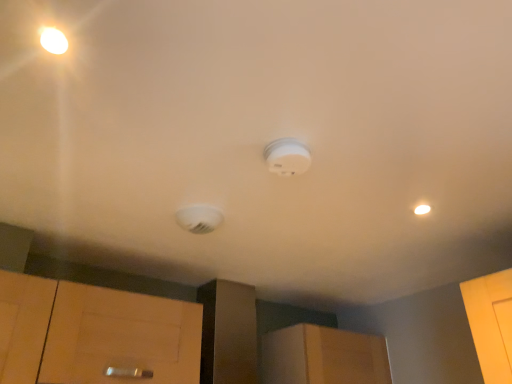
Question: Visually, is wooden cabinet at center positioned to the left or to the right of white plastic smoke detector at center?

Choices:
 (A) right
 (B) left

Answer: (A)

Question: Considering their positions, is wooden cabinet at center located in front of or behind white plastic smoke detector at center?

Choices:
 (A) front
 (B) behind

Answer: (B)

Question: Is wooden cabinet at center inside or outside of white plastic smoke detector at center?

Choices:
 (A) inside
 (B) outside

Answer: (B)

Question: From a real-world perspective, is white plastic smoke detector at center physically located above or below wooden cabinet at center?

Choices:
 (A) below
 (B) above

Answer: (B)

Question: Considering their positions, is white plastic smoke detector at center located in front of or behind wooden cabinet at center?

Choices:
 (A) front
 (B) behind

Answer: (A)

Question: Considering the positions of white plastic smoke detector at center and wooden cabinet at center in the image, is white plastic smoke detector at center wider or thinner than wooden cabinet at center?

Choices:
 (A) thin
 (B) wide

Answer: (A)

Question: From the image's perspective, is white plastic smoke detector at center positioned above or below wooden cabinet at center?

Choices:
 (A) above
 (B) below

Answer: (A)